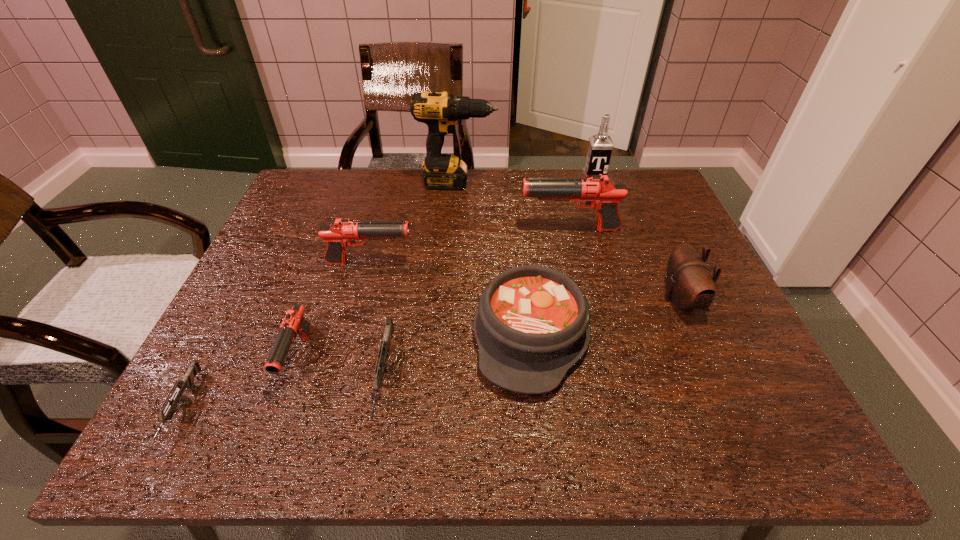
Locate an element on the screen. Image resolution: width=960 pixels, height=540 pixels. vacant region located 0.290m at the aiming end of the farthest gun is located at coordinates (413, 230).

This screenshot has height=540, width=960. What are the coordinates of `vacant area situated 0.170m at the aiming end of the second biggest black gun` in the screenshot? It's located at (481, 263).

What are the coordinates of `free region located with the flap open on the brown pouch` in the screenshot? It's located at (523, 299).

This screenshot has height=540, width=960. I want to click on vacant region located with the flap open on the brown pouch, so click(x=619, y=299).

Find the location of a particular element. Image resolution: width=960 pixels, height=540 pixels. blank area located with the flap open on the brown pouch is located at coordinates (502, 299).

Image resolution: width=960 pixels, height=540 pixels. Find the location of `free space located on the left of the gray casserole`. free space located on the left of the gray casserole is located at coordinates (304, 334).

Where is `drill that is at the far edge`? drill that is at the far edge is located at coordinates (440, 111).

The width and height of the screenshot is (960, 540). Identify the location of vodka located at the far edge. (600, 147).

This screenshot has width=960, height=540. What are the coordinates of `object positioned at the left edge` in the screenshot? It's located at (187, 382).

Find the location of a particular element. object located at the right edge is located at coordinates point(690,284).